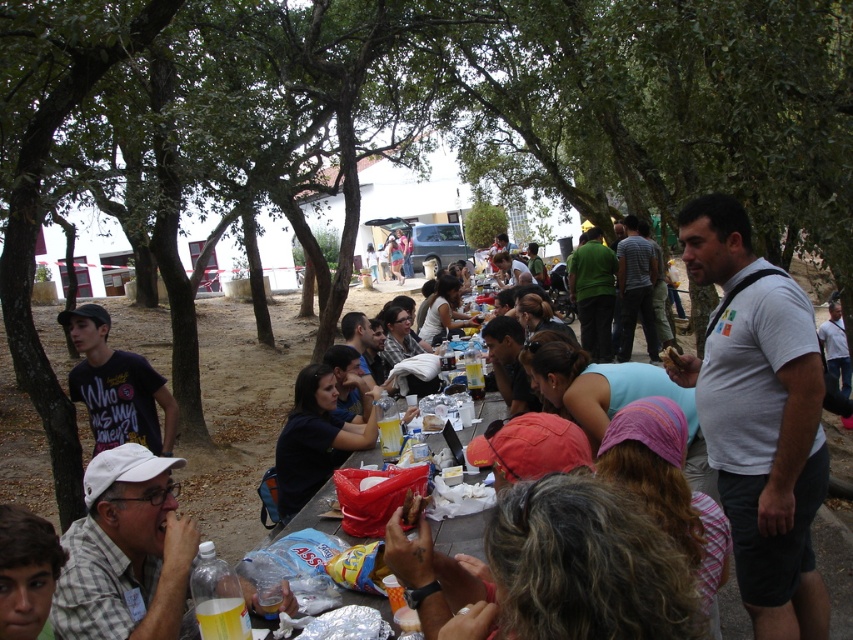
Question: Which point is closer to the camera?

Choices:
 (A) (80, 326)
 (B) (779, 272)
 (C) (68, 548)

Answer: (C)

Question: Which of the following is the farthest from the observer?

Choices:
 (A) matte black shirt at center
 (B) white cotton shirt at right

Answer: (A)

Question: Can you confirm if matte black t-shirt at left is positioned below light brown hair at lower left?

Choices:
 (A) yes
 (B) no

Answer: (B)

Question: Is white cotton shirt at right positioned at the back of light brown hair at lower left?

Choices:
 (A) yes
 (B) no

Answer: (A)

Question: Which object is the farthest from the light brown hair at lower left?

Choices:
 (A) matte black t-shirt at left
 (B) matte black shirt at center
 (C) gray checkered shirt at lower left
 (D) white cotton shirt at right

Answer: (A)

Question: Is matte black shirt at center to the right of light brown hair at lower left from the viewer's perspective?

Choices:
 (A) yes
 (B) no

Answer: (A)